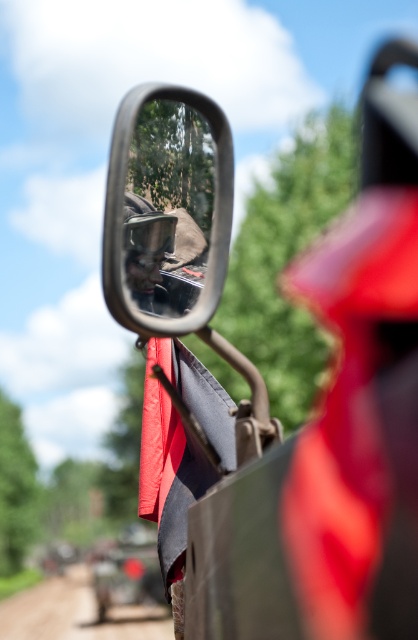
You are a driver checking your side mirror. You notice a point marked at coordinates (168, 205) in the mirror. Based on the scene description, what object is located at that point?

The point at coordinates (168, 205) marks the clear plastic mirror at center.

You are a driver checking your side mirror before merging onto a rural road. The clear plastic mirror at center is positioned at coordinates 0.323 on the x and 0.402 on the y. If the road is 10 meters wide, can you safely merge without adjusting the mirror?

The clear plastic mirror at center is located at point [168,205], which means it is positioned in the center area of the vehicle. Since the road is 10 meters wide, adjusting the mirror might still be necessary to ensure full visibility of the road during merging. However, without knowing the exact dimensions of the vehicle and mirror coverage, it is difficult to determine safety without adjustment.